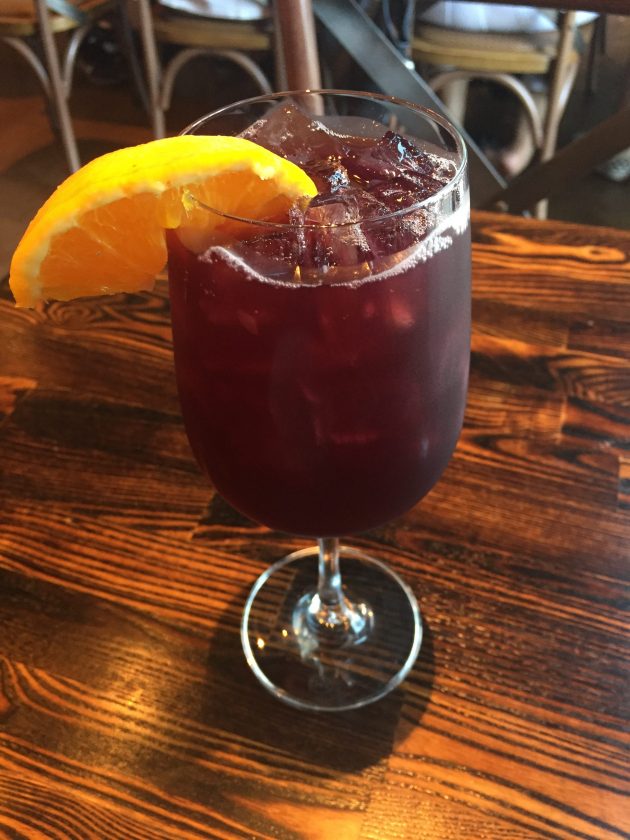
Identify the location of bowl of glass. This screenshot has width=630, height=840. (420, 417).